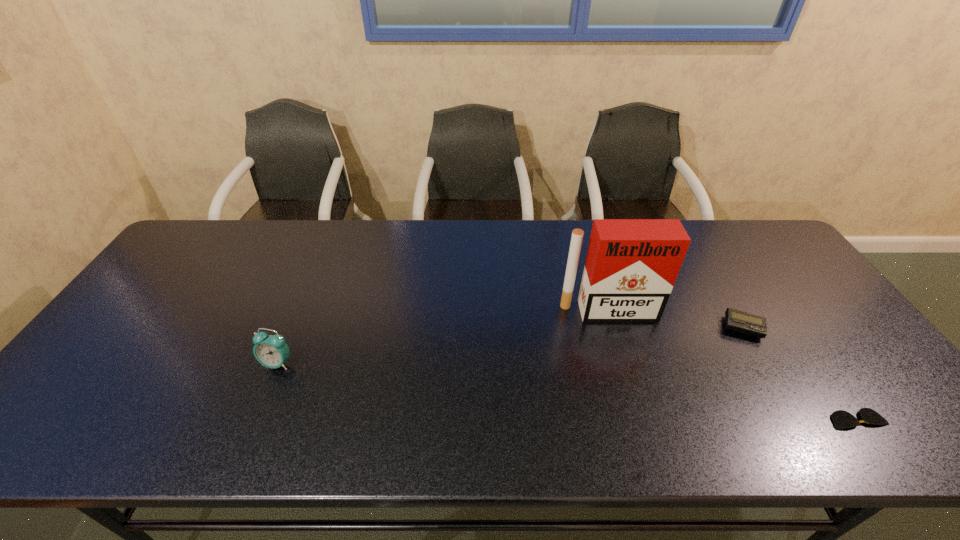
In order to click on free space that satisfies the following two spatial constraints: 1. on the front-facing side of the rightmost object; 2. on the left side of the tallest object in this screenshot , I will do `click(640, 420)`.

In order to click on free space that satisfies the following two spatial constraints: 1. on the front-facing side of the third tallest object; 2. on the right side of the tallest object in this screenshot , I will do click(613, 327).

I want to click on free spot that satisfies the following two spatial constraints: 1. on the front-facing side of the third object from right to left; 2. on the left side of the second shortest object, so click(613, 327).